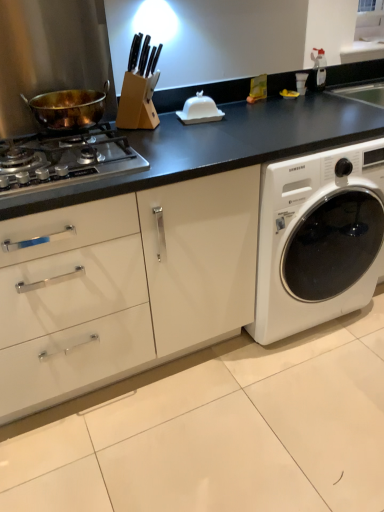
You are a GUI agent. You are given a task and a screenshot of the screen. Output one action in this format:
    pyautogui.click(x=<x>, y=<y>)
    Task: Click on the white matte washing machine at center-right
    Image resolution: width=384 pixels, height=512 pixels.
    Given the screenshot: What is the action you would take?
    pyautogui.click(x=318, y=238)

The height and width of the screenshot is (512, 384). Find the location of `gold-bronze wok at left`. gold-bronze wok at left is located at coordinates (68, 108).

Which of these two, white matte washing machine at center-right or white glossy butter dish at center, stands shorter?

white glossy butter dish at center.

Is white matte washing machine at center-right bigger than white glossy butter dish at center?

Yes.

How different are the orientations of white matte washing machine at center-right and white glossy butter dish at center in degrees?

The angular difference between white matte washing machine at center-right and white glossy butter dish at center is 10.4 degrees.

Is gold-bronze wok at left thinner than white glossy butter dish at center?

No, gold-bronze wok at left is not thinner than white glossy butter dish at center.

From a real-world perspective, is gold-bronze wok at left positioned above or below white glossy butter dish at center?

gold-bronze wok at left is situated higher than white glossy butter dish at center in the real world.

Which of these two, gold-bronze wok at left or white glossy butter dish at center, stands shorter?

white glossy butter dish at center is shorter.

Is gold-bronze wok at left positioned beyond the bounds of white glossy butter dish at center?

Yes.

Considering the positions of objects gold-bronze wok at left and stainless steel gas stove at left in the image provided, who is more to the right, gold-bronze wok at left or stainless steel gas stove at left?

gold-bronze wok at left is more to the right.

Find the location of a particular element. This screenshot has width=384, height=512. wok above the stainless steel gas stove at left (from the image's perspective) is located at coordinates (68, 108).

Is gold-bronze wok at left beside stainless steel gas stove at left?

gold-bronze wok at left and stainless steel gas stove at left are clearly separated.

Is gold-bronze wok at left closer to camera compared to stainless steel gas stove at left?

No.

Which is behind, white glossy butter dish at center or stainless steel gas stove at left?

white glossy butter dish at center.

From a real-world perspective, who is located lower, white glossy butter dish at center or stainless steel gas stove at left?

stainless steel gas stove at left, from a real-world perspective.

Which is farther from the camera, [216,118] or [74,150]?

The point [216,118] is more distant.

From the image's perspective, which one is positioned lower, white glossy butter dish at center or stainless steel gas stove at left?

stainless steel gas stove at left is shown below in the image.

Considering the relative positions of stainless steel gas stove at left and white matte washing machine at center-right in the image provided, is stainless steel gas stove at left to the left of white matte washing machine at center-right from the viewer's perspective?

Correct, you'll find stainless steel gas stove at left to the left of white matte washing machine at center-right.

Who is smaller, stainless steel gas stove at left or white matte washing machine at center-right?

With smaller size is stainless steel gas stove at left.

Are stainless steel gas stove at left and white matte washing machine at center-right far apart?

No, there isn't a large distance between stainless steel gas stove at left and white matte washing machine at center-right.

From a real-world perspective, is gold-bronze wok at left physically located above or below white matte washing machine at center-right?

From a real-world perspective, gold-bronze wok at left is physically above white matte washing machine at center-right.

Which is more to the left, gold-bronze wok at left or white matte washing machine at center-right?

gold-bronze wok at left.

Can you confirm if gold-bronze wok at left is shorter than white matte washing machine at center-right?

Indeed, gold-bronze wok at left has a lesser height compared to white matte washing machine at center-right.

Looking at their sizes, would you say gold-bronze wok at left is wider or thinner than white matte washing machine at center-right?

In the image, gold-bronze wok at left appears to be more narrow than white matte washing machine at center-right.

From a real-world perspective, which object stands above the other?

stainless steel gas stove at left, from a real-world perspective.

Are white matte washing machine at center-right and stainless steel gas stove at left far apart?

No, white matte washing machine at center-right is not far from stainless steel gas stove at left.

Which of these two, white matte washing machine at center-right or stainless steel gas stove at left, is wider?

white matte washing machine at center-right is wider.

Between point (301, 319) and point (47, 157), which one is positioned behind?

Positioned behind is point (301, 319).

Image resolution: width=384 pixels, height=512 pixels. Identify the location of appliance behind the white matte washing machine at center-right. (199, 110).

Find the location of a particular element. appliance located underneath the gold-bronze wok at left (from a real-world perspective) is located at coordinates 199,110.

Estimate the real-world distances between objects in this image. Which object is further from white matte washing machine at center-right, stainless steel gas stove at left or gold-bronze wok at left?

gold-bronze wok at left lies further to white matte washing machine at center-right than the other object.

Estimate the real-world distances between objects in this image. Which object is further from gold-bronze wok at left, white matte washing machine at center-right or white glossy butter dish at center?

white matte washing machine at center-right is positioned further to the anchor gold-bronze wok at left.

Considering their positions, is white matte washing machine at center-right positioned further to white glossy butter dish at center than stainless steel gas stove at left?

The object further to white glossy butter dish at center is white matte washing machine at center-right.

When comparing their distances from white matte washing machine at center-right, does white glossy butter dish at center or gold-bronze wok at left seem further?

Based on the image, gold-bronze wok at left appears to be further to white matte washing machine at center-right.

Based on their spatial positions, is white matte washing machine at center-right or stainless steel gas stove at left closer to gold-bronze wok at left?

Based on the image, stainless steel gas stove at left appears to be nearer to gold-bronze wok at left.

Considering their positions, is stainless steel gas stove at left positioned closer to white glossy butter dish at center than white matte washing machine at center-right?

The object closer to white glossy butter dish at center is stainless steel gas stove at left.

Based on their spatial positions, is stainless steel gas stove at left or gold-bronze wok at left closer to white glossy butter dish at center?

Among the two, gold-bronze wok at left is located nearer to white glossy butter dish at center.

Based on their spatial positions, is white matte washing machine at center-right or gold-bronze wok at left closer to white glossy butter dish at center?

Based on the image, gold-bronze wok at left appears to be nearer to white glossy butter dish at center.

You are a GUI agent. You are given a task and a screenshot of the screen. Output one action in this format:
    pyautogui.click(x=<x>, y=<y>)
    Task: Click on the appliance located between stainless steel gas stove at left and white matte washing machine at center-right in the left-right direction
    The image size is (384, 512).
    Given the screenshot: What is the action you would take?
    pyautogui.click(x=199, y=110)

Locate an element on the screen. This screenshot has width=384, height=512. wok between stainless steel gas stove at left and white glossy butter dish at center from left to right is located at coordinates (68, 108).

The image size is (384, 512). What are the coordinates of `appliance between gold-bronze wok at left and white matte washing machine at center-right in the horizontal direction` in the screenshot? It's located at (199, 110).

The width and height of the screenshot is (384, 512). What are the coordinates of `wok located between stainless steel gas stove at left and white matte washing machine at center-right in the left-right direction` in the screenshot? It's located at (68, 108).